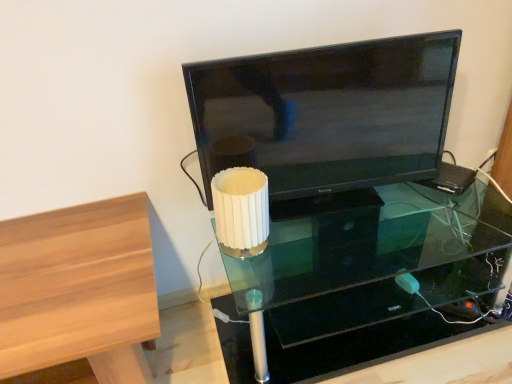
Question: Is the depth of matte black tv at center greater than that of transparent glass table at center?

Choices:
 (A) yes
 (B) no

Answer: (A)

Question: Can you confirm if matte black tv at center is positioned to the left of transparent glass table at center?

Choices:
 (A) yes
 (B) no

Answer: (A)

Question: From a real-world perspective, is matte black tv at center over transparent glass table at center?

Choices:
 (A) yes
 (B) no

Answer: (A)

Question: Is matte black tv at center at the right side of transparent glass table at center?

Choices:
 (A) no
 (B) yes

Answer: (A)

Question: From the image's perspective, is matte black tv at center on transparent glass table at center?

Choices:
 (A) no
 (B) yes

Answer: (B)

Question: Is white ribbed plastic at center to the left or to the right of matte black tv at center in the image?

Choices:
 (A) right
 (B) left

Answer: (B)

Question: Looking at their shapes, would you say white ribbed plastic at center is wider or thinner than matte black tv at center?

Choices:
 (A) thin
 (B) wide

Answer: (B)

Question: Looking at the image, does white ribbed plastic at center seem bigger or smaller compared to matte black tv at center?

Choices:
 (A) small
 (B) big

Answer: (A)

Question: In the image, is white ribbed plastic at center positioned in front of or behind matte black tv at center?

Choices:
 (A) front
 (B) behind

Answer: (B)

Question: From a real-world perspective, is light brown wood table at left physically located above or below transparent glass table at center?

Choices:
 (A) below
 (B) above

Answer: (B)

Question: Looking at their shapes, would you say light brown wood table at left is wider or thinner than transparent glass table at center?

Choices:
 (A) thin
 (B) wide

Answer: (B)

Question: In the image, is light brown wood table at left positioned in front of or behind transparent glass table at center?

Choices:
 (A) front
 (B) behind

Answer: (A)

Question: From the image's perspective, is light brown wood table at left above or below transparent glass table at center?

Choices:
 (A) above
 (B) below

Answer: (B)

Question: Would you say transparent glass table at center is to the left or to the right of matte black tv at center in the picture?

Choices:
 (A) left
 (B) right

Answer: (B)

Question: Considering the positions of transparent glass table at center and matte black tv at center in the image, is transparent glass table at center taller or shorter than matte black tv at center?

Choices:
 (A) short
 (B) tall

Answer: (A)